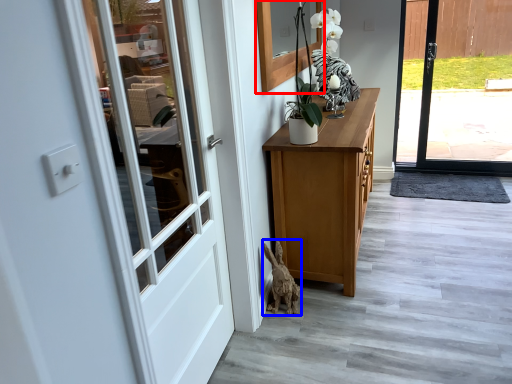
Question: Which point is closer to the camera, window (highlighted by a red box) or animal (highlighted by a blue box)?

Choices:
 (A) window
 (B) animal

Answer: (A)